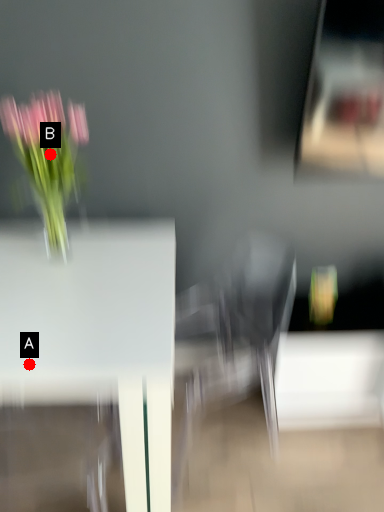
Question: Two points are circled on the image, labeled by A and B beside each circle. Which of the following is the closest to the observer?

Choices:
 (A) A is closer
 (B) B is closer

Answer: (A)